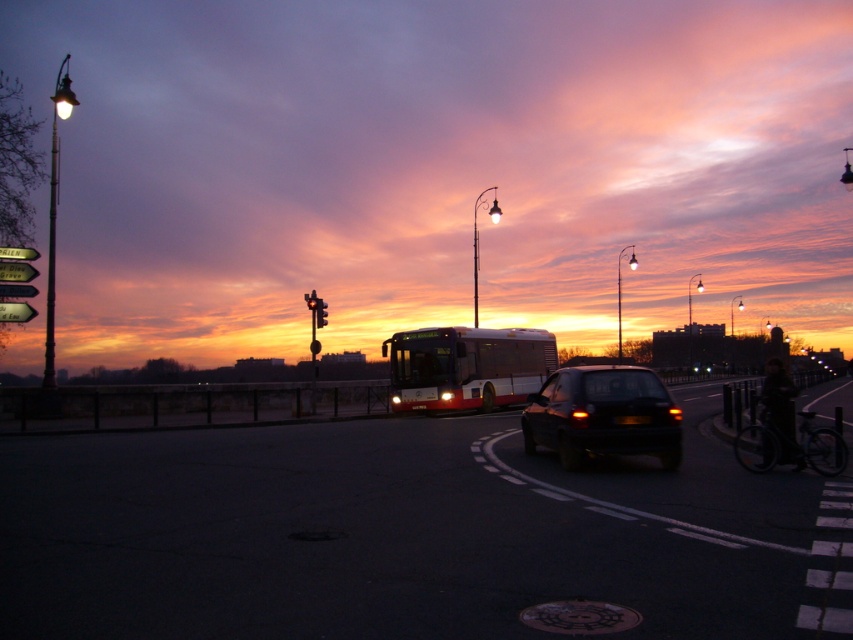
Is point (560, 387) positioned after point (326, 314)?

No, (560, 387) is closer to viewer.

What do you see at coordinates (602, 416) in the screenshot? I see `shiny black car at center` at bounding box center [602, 416].

The image size is (853, 640). Find the location of `shiny black car at center`. shiny black car at center is located at coordinates (602, 416).

Looking at this image, which of these two, metallic bus at center or red glass traffic light at upper center, stands shorter?

Standing shorter between the two is red glass traffic light at upper center.

From the picture: Can you confirm if metallic bus at center is thinner than red glass traffic light at upper center?

In fact, metallic bus at center might be wider than red glass traffic light at upper center.

Who is more distant from viewer, (62,17) or (325,307)?

The point (62,17) is more distant.

This screenshot has width=853, height=640. I want to click on metallic bus at center, so click(438, 168).

From the picture: Is metallic bus at center positioned behind red metallic bus at center?

No, it is in front of red metallic bus at center.

Between metallic bus at center and red metallic bus at center, which one is positioned lower?

red metallic bus at center is lower down.

Who is more distant from viewer, (718,204) or (548,368)?

The point (718,204) is behind.

In order to click on metallic bus at center in this screenshot , I will do `click(438, 168)`.